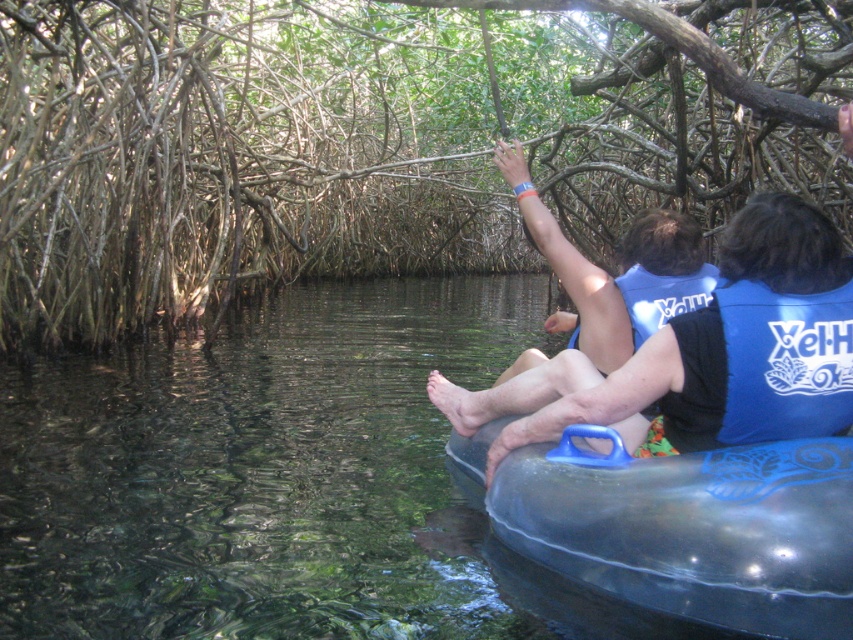
Between brown textured tree roots at center and blue life vest at center, which one has less height?

blue life vest at center

Can you confirm if brown textured tree roots at center is positioned to the right of blue life vest at center?

Correct, you'll find brown textured tree roots at center to the right of blue life vest at center.

Is point (294, 17) farther from camera compared to point (747, 253)?

Yes, point (294, 17) is farther from viewer.

Image resolution: width=853 pixels, height=640 pixels. I want to click on brown textured tree roots at center, so click(x=379, y=140).

Can you confirm if clear water at center is shorter than blue fabric life jacket at center?

Incorrect, clear water at center's height does not fall short of blue fabric life jacket at center's.

The image size is (853, 640). Identify the location of clear water at center. (x=277, y=481).

Is point (445, 400) less distant than point (705, 280)?

That is False.

Does blue life vest at center come in front of blue fabric life jacket at center?

Yes, blue life vest at center is in front of blue fabric life jacket at center.

Is point (833, 362) positioned after point (704, 272)?

No.

Where is `blue life vest at center`? The image size is (853, 640). blue life vest at center is located at coordinates (706, 355).